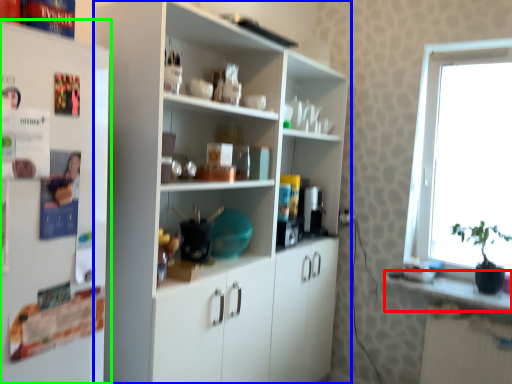
Question: Based on their relative distances, which object is nearer to counter top (highlighted by a red box)? Choose from cupboard (highlighted by a blue box) and refrigerator (highlighted by a green box).

Choices:
 (A) cupboard
 (B) refrigerator

Answer: (A)